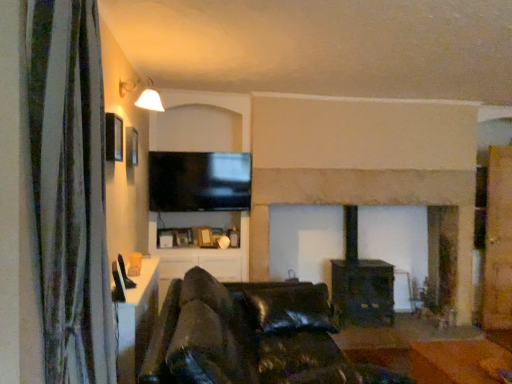
Question: From the image's perspective, is black leather couch at center on top of green fabric curtain at left?

Choices:
 (A) yes
 (B) no

Answer: (B)

Question: From the image's perspective, is black leather couch at center below green fabric curtain at left?

Choices:
 (A) no
 (B) yes

Answer: (B)

Question: Is black leather couch at center shorter than green fabric curtain at left?

Choices:
 (A) yes
 (B) no

Answer: (A)

Question: Is black leather couch at center further to camera compared to green fabric curtain at left?

Choices:
 (A) yes
 (B) no

Answer: (A)

Question: Considering the relative sizes of black leather couch at center and green fabric curtain at left in the image provided, is black leather couch at center smaller than green fabric curtain at left?

Choices:
 (A) yes
 (B) no

Answer: (B)

Question: Considering the positions of matte white lampshade at upper left and orange leather couch at lower center in the image, is matte white lampshade at upper left wider or thinner than orange leather couch at lower center?

Choices:
 (A) wide
 (B) thin

Answer: (B)

Question: From the image's perspective, is matte white lampshade at upper left located above or below orange leather couch at lower center?

Choices:
 (A) below
 (B) above

Answer: (B)

Question: Looking at the image, does matte white lampshade at upper left seem bigger or smaller compared to orange leather couch at lower center?

Choices:
 (A) small
 (B) big

Answer: (A)

Question: From a real-world perspective, relative to orange leather couch at lower center, is matte white lampshade at upper left vertically above or below?

Choices:
 (A) below
 (B) above

Answer: (B)

Question: From a real-world perspective, is black leather couch at center positioned above or below stone fireplace at center?

Choices:
 (A) below
 (B) above

Answer: (A)

Question: Considering the positions of black leather couch at center and stone fireplace at center in the image, is black leather couch at center bigger or smaller than stone fireplace at center?

Choices:
 (A) big
 (B) small

Answer: (B)

Question: In the image, is black leather couch at center positioned in front of or behind stone fireplace at center?

Choices:
 (A) front
 (B) behind

Answer: (A)

Question: From the image's perspective, is black leather couch at center positioned above or below stone fireplace at center?

Choices:
 (A) above
 (B) below

Answer: (B)

Question: Considering the relative positions of green fabric curtain at left and black glossy tv at upper center in the image provided, is green fabric curtain at left to the left or to the right of black glossy tv at upper center?

Choices:
 (A) right
 (B) left

Answer: (B)

Question: Is green fabric curtain at left situated inside black glossy tv at upper center or outside?

Choices:
 (A) inside
 (B) outside

Answer: (B)